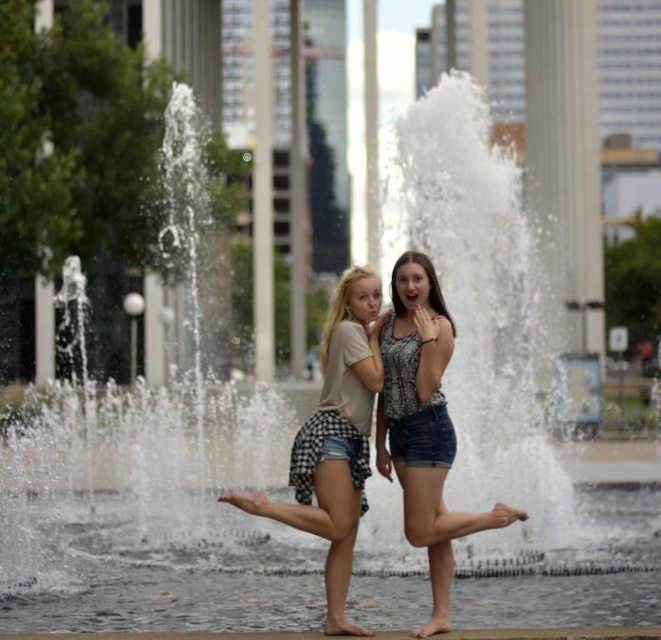
You are a photographer aiming to capture the patterned fabric top at center in the image. Based on its position, which part of the fountain area would you focus on to ensure the top is in the frame?

The patterned fabric top at center is located at point coordinates (422, 426), so focusing on the central area of the fountain where these coordinates align would ensure the top is in the frame.

You are a photographer trying to capture a clear shot of both the patterned fabric top at center and the checkered denim shorts at center. Since the two are positioned closely, you need to adjust your focus. Which object should you focus on first to ensure the smaller one is sharp?

The patterned fabric top at center has a smaller size compared to checkered denim shorts at center, so you should focus on the patterned fabric top at center first to ensure its details are sharp before adjusting for the larger checkered denim shorts at center.

You are trying to decide which clothing item to adjust first to make more space in your small closet. You see the patterned fabric top at center and the checkered denim shorts at center. Which item takes up more space when folded?

The checkered denim shorts at center takes up more space when folded because its width is greater than the patterned fabric top at center.